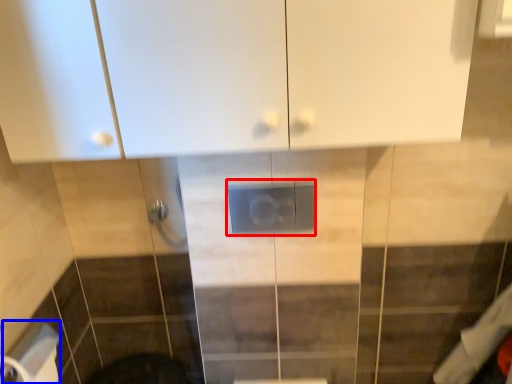
Question: Which object is closer to the camera taking this photo, electric outlet (highlighted by a red box) or toilet paper (highlighted by a blue box)?

Choices:
 (A) electric outlet
 (B) toilet paper

Answer: (B)